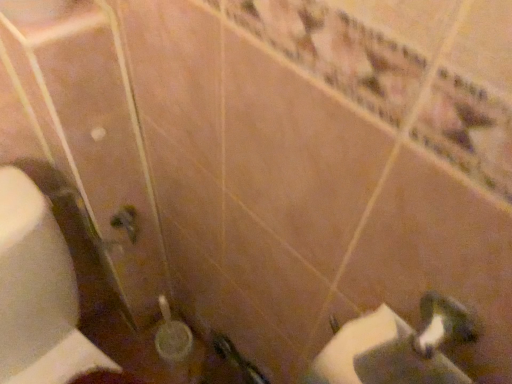
Question: From the image's perspective, is white glossy sink at lower right over white matte toilet paper at lower left?

Choices:
 (A) no
 (B) yes

Answer: (B)

Question: Could you tell me if white glossy sink at lower right is facing white matte toilet paper at lower left?

Choices:
 (A) yes
 (B) no

Answer: (B)

Question: Would you say white glossy sink at lower right is outside white matte toilet paper at lower left?

Choices:
 (A) no
 (B) yes

Answer: (B)

Question: Is white glossy sink at lower right turned away from white matte toilet paper at lower left?

Choices:
 (A) yes
 (B) no

Answer: (B)

Question: Does white glossy sink at lower right have a lesser height compared to white matte toilet paper at lower left?

Choices:
 (A) yes
 (B) no

Answer: (A)

Question: Is white glossy sink at lower right far from white matte toilet paper at lower left?

Choices:
 (A) no
 (B) yes

Answer: (A)

Question: Could you tell me if white matte toilet paper at lower left is turned towards white glossy sink at lower right?

Choices:
 (A) yes
 (B) no

Answer: (B)

Question: Is white matte toilet paper at lower left oriented away from white glossy sink at lower right?

Choices:
 (A) no
 (B) yes

Answer: (A)

Question: Could white glossy sink at lower right be considered to be inside white matte toilet paper at lower left?

Choices:
 (A) yes
 (B) no

Answer: (B)

Question: Does white matte toilet paper at lower left have a larger size compared to white glossy sink at lower right?

Choices:
 (A) yes
 (B) no

Answer: (A)

Question: Can you confirm if white matte toilet paper at lower left is taller than white glossy sink at lower right?

Choices:
 (A) no
 (B) yes

Answer: (B)

Question: Is white matte toilet paper at lower left smaller than white glossy sink at lower right?

Choices:
 (A) yes
 (B) no

Answer: (B)

Question: From the image's perspective, is white matte toilet paper at lower left positioned above or below white glossy sink at lower right?

Choices:
 (A) below
 (B) above

Answer: (A)